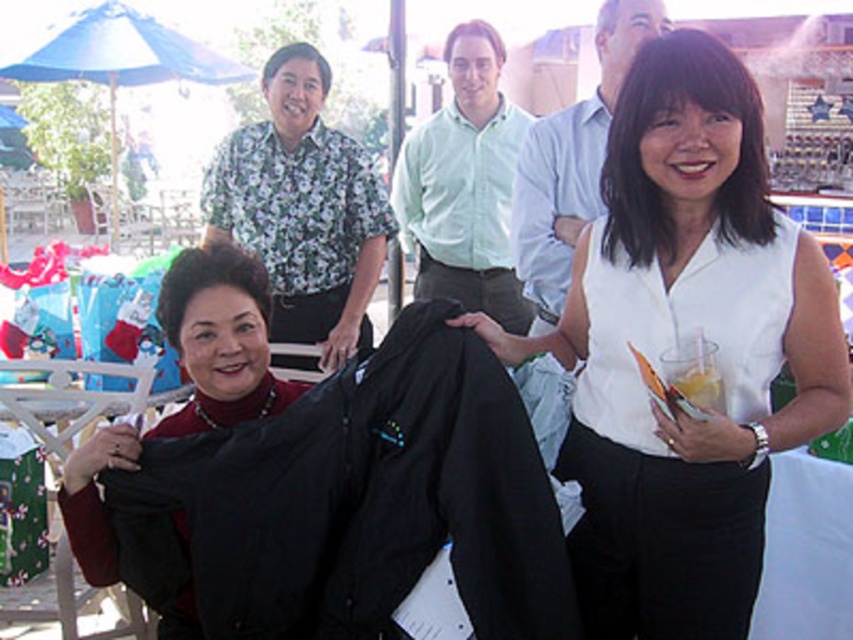
You are standing at point (49, 396) and want to walk to point (224, 81). Is the destination point behind you or in front of you?

The destination point (224, 81) is behind point (49, 396), so the destination is behind you.

You are a photographer setting up for a group photo. You notice the floral shirt at upper left and the metallic white chair at lower left. Which object is positioned higher in the image?

The floral shirt at upper left is positioned higher in the image than the metallic white chair at lower left.